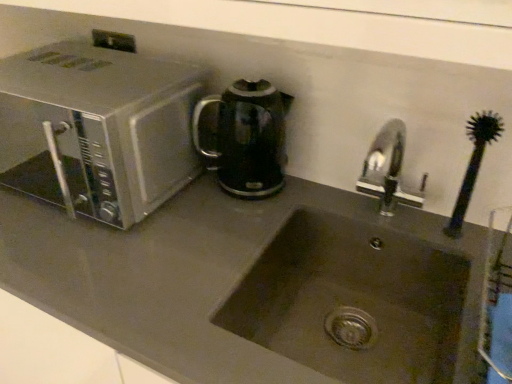
This screenshot has height=384, width=512. I want to click on vacant space in between silver metallic microwave at left and black glossy electric kettle at center, so click(x=197, y=217).